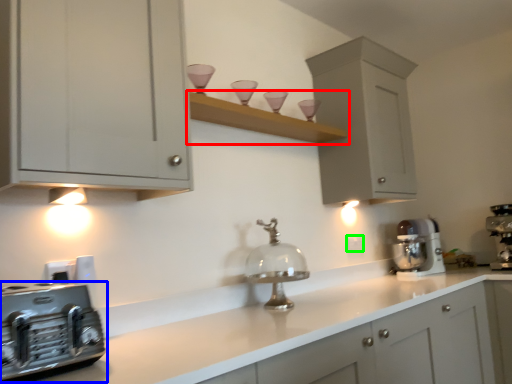
Question: Based on their relative distances, which object is farther from shelf (highlighted by a red box)? Choose from home appliance (highlighted by a blue box) and electric outlet (highlighted by a green box).

Choices:
 (A) home appliance
 (B) electric outlet

Answer: (A)